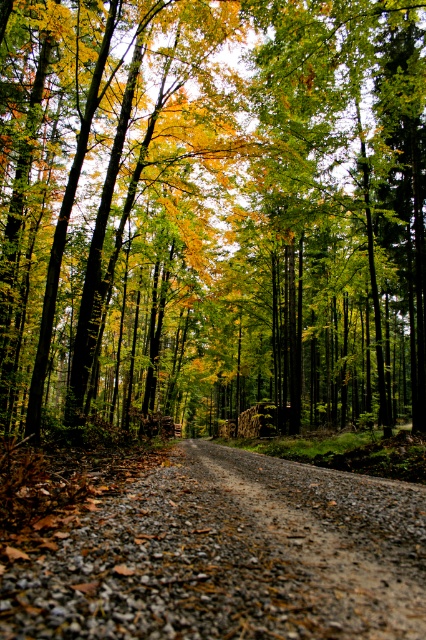
You are standing on the gravel path in the forest and see two points marked in the scene. Which point is closer to you, point (97,17) or point (342,568)?

Point (97,17) is closer to you because it is further to the viewer than point (342,568).

You are a hiker walking along the gray gravel road at center and want to know if the golden leafy trees at center are wider than the road. Can you confirm this?

The golden leafy trees at center are wider than the gray gravel road at center according to the description.

You are standing on the gray gravel road at center and looking towards the golden leafy trees at center. Which object is higher in elevation?

The golden leafy trees at center are taller than the gray gravel road at center, so the golden leafy trees at center are higher in elevation.